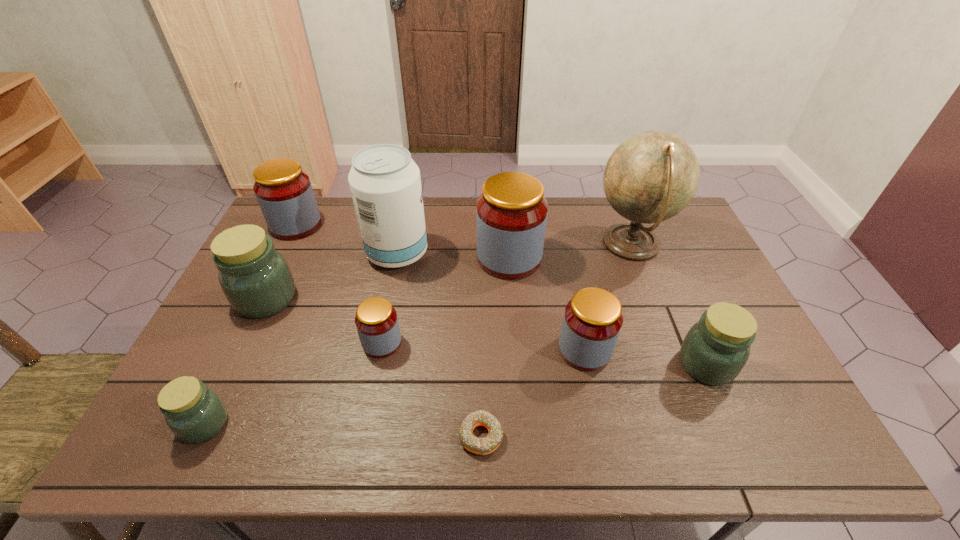
Find the location of a particular element. This screenshot has width=960, height=540. globe is located at coordinates (652, 176).

Where is `alcohol`? The image size is (960, 540). alcohol is located at coordinates (385, 183).

Image resolution: width=960 pixels, height=540 pixels. Find the location of `the third red jar from left to right`. the third red jar from left to right is located at coordinates (x=511, y=216).

Locate an element on the screen. The height and width of the screenshot is (540, 960). the tallest jar is located at coordinates (511, 216).

At what (x,y) coordinates should I click in order to perform the action: click on the second biggest red jar. Please return your answer as a coordinate pair (x, y). The width and height of the screenshot is (960, 540). Looking at the image, I should click on (284, 192).

Identify the location of the biggest green jar. The image size is (960, 540). (255, 278).

Locate an element on the screen. This screenshot has height=540, width=960. the second farthest green jar is located at coordinates (716, 348).

The image size is (960, 540). What are the coordinates of `the rightmost jar` in the screenshot? It's located at (716, 348).

Find the location of a particular element. the third object from right to left is located at coordinates (592, 321).

Locate an element on the screen. the third biggest red jar is located at coordinates (592, 321).